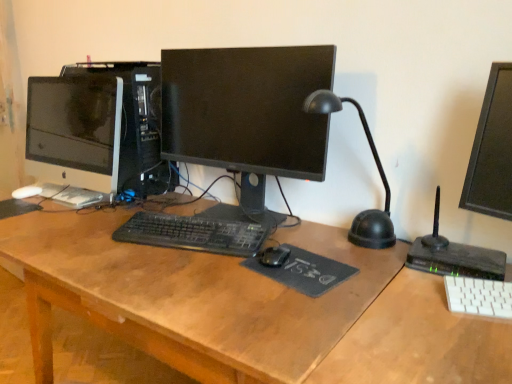
Image resolution: width=512 pixels, height=384 pixels. I want to click on vacant space to the right of black matte mouse at center, so click(353, 257).